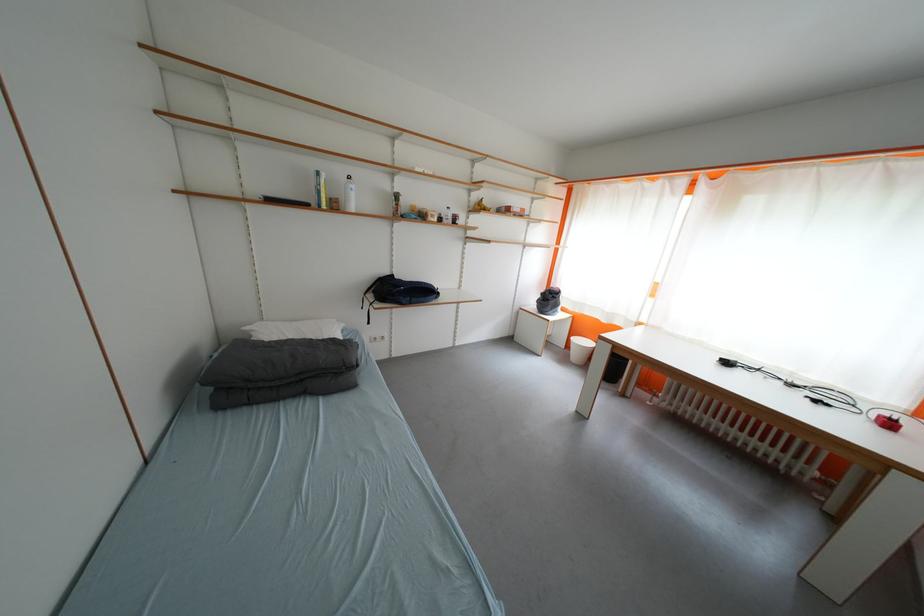
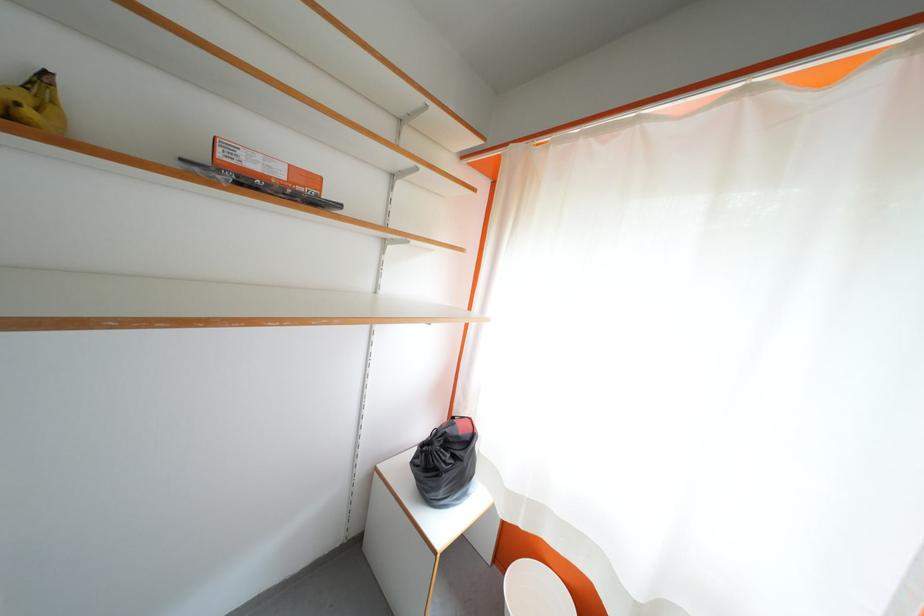
Locate, in the second image, the point that corresponds to the point at 558,302 in the first image.

(455, 460)